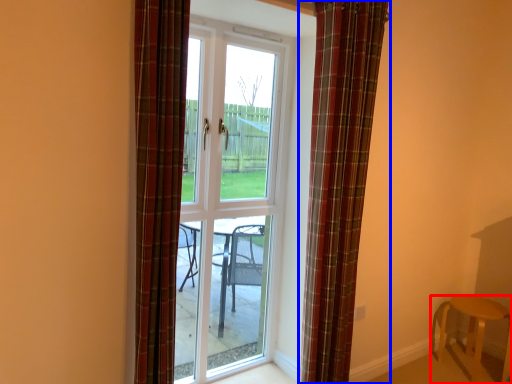
Question: Among these objects, which one is nearest to the camera, furniture (highlighted by a red box) or curtain (highlighted by a blue box)?

Choices:
 (A) furniture
 (B) curtain

Answer: (B)